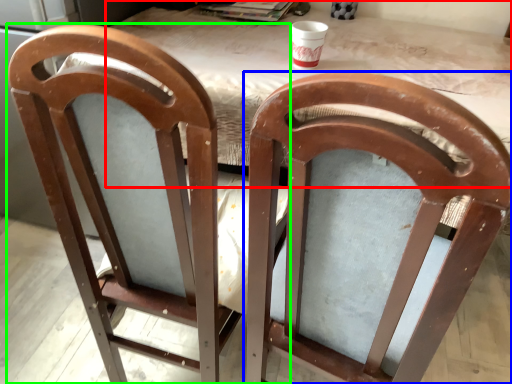
Question: Which object is the closest to the table (highlighted by a red box)? Choose among these: chair (highlighted by a blue box) or chair (highlighted by a green box).

Choices:
 (A) chair
 (B) chair

Answer: (A)